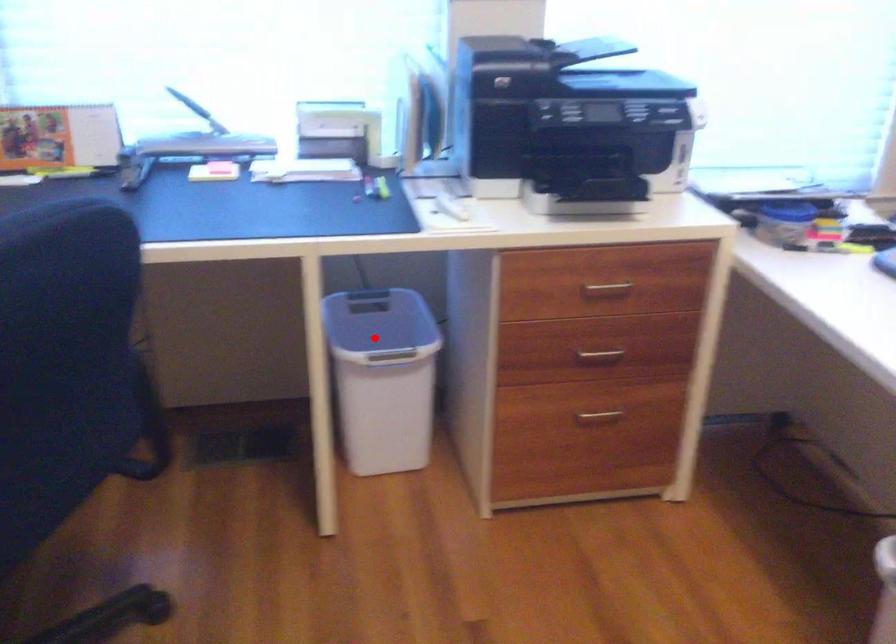
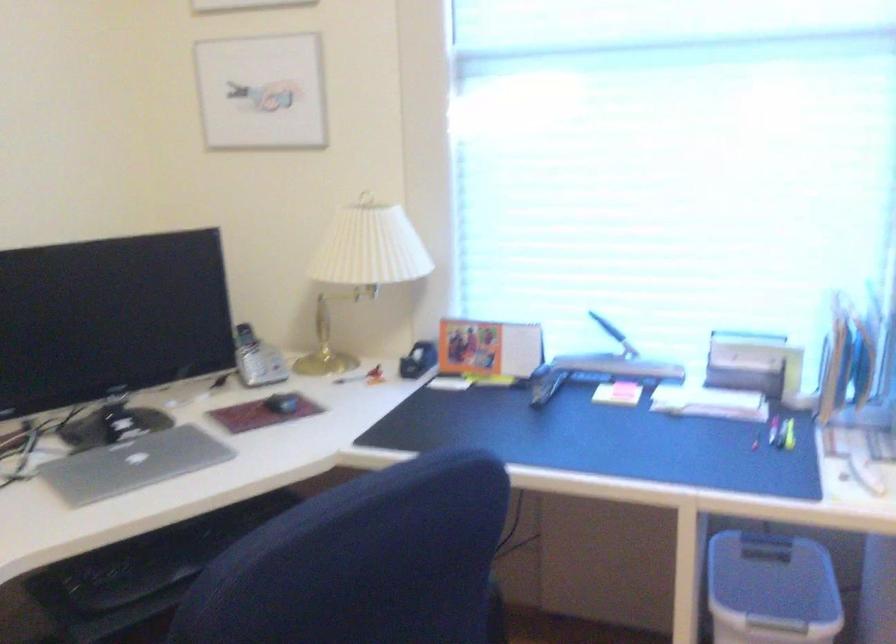
Question: A red point is marked in image1. In image2, is the corresponding 3D point closer to the camera or farther? Reply with the corresponding letter.

Choices:
 (A) The corresponding 3D point is closer.
 (B) The corresponding 3D point is farther.

Answer: (A)